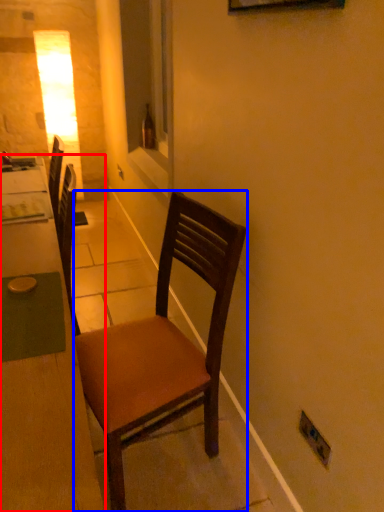
Question: Which object is further to the camera taking this photo, desk (highlighted by a red box) or chair (highlighted by a blue box)?

Choices:
 (A) desk
 (B) chair

Answer: (B)